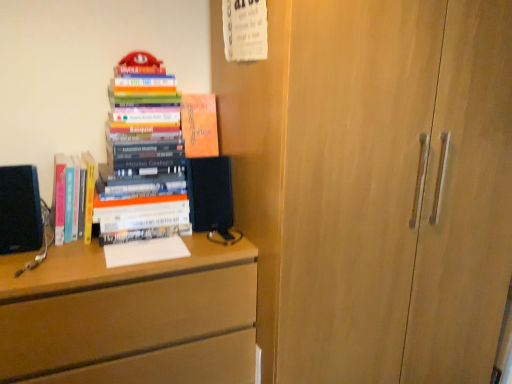
Question: Considering the relative sizes of hardcover books at left, placed as the 1th book when sorted from left to right, and black matte speaker at center in the image provided, is hardcover books at left, placed as the 1th book when sorted from left to right, taller than black matte speaker at center?

Choices:
 (A) yes
 (B) no

Answer: (B)

Question: Does hardcover books at left, placed as the 1th book when sorted from left to right, have a greater width compared to black matte speaker at center?

Choices:
 (A) no
 (B) yes

Answer: (B)

Question: Can you confirm if hardcover books at left, the third book from the right, is bigger than black matte speaker at center?

Choices:
 (A) yes
 (B) no

Answer: (A)

Question: From a real-world perspective, does hardcover books at left, placed as the 1th book when sorted from left to right, sit lower than black matte speaker at center?

Choices:
 (A) no
 (B) yes

Answer: (B)

Question: Is hardcover books at left, placed as the 1th book when sorted from left to right, at the left side of black matte speaker at center?

Choices:
 (A) yes
 (B) no

Answer: (A)

Question: Is hardcover books at left, the third book from the right, looking in the opposite direction of black matte speaker at center?

Choices:
 (A) yes
 (B) no

Answer: (B)

Question: Does matte orange book at upper center, the first book from the right, contain matte wood chest of drawers at left?

Choices:
 (A) yes
 (B) no

Answer: (B)

Question: Can you confirm if matte orange book at upper center, marked as the 3th book in a left-to-right arrangement, is thinner than matte wood chest of drawers at left?

Choices:
 (A) no
 (B) yes

Answer: (B)

Question: Can you confirm if matte orange book at upper center, the first book from the right, is bigger than matte wood chest of drawers at left?

Choices:
 (A) no
 (B) yes

Answer: (A)

Question: From the image's perspective, is matte orange book at upper center, the first book from the right, located beneath matte wood chest of drawers at left?

Choices:
 (A) yes
 (B) no

Answer: (B)

Question: From the image's perspective, would you say matte orange book at upper center, marked as the 3th book in a left-to-right arrangement, is positioned over matte wood chest of drawers at left?

Choices:
 (A) no
 (B) yes

Answer: (B)

Question: Does matte orange book at upper center, marked as the 3th book in a left-to-right arrangement, have a lesser height compared to matte wood chest of drawers at left?

Choices:
 (A) no
 (B) yes

Answer: (B)

Question: Is matte wood chest of drawers at left positioned with its back to hardcover books at left, the 2th book viewed from the right?

Choices:
 (A) no
 (B) yes

Answer: (A)